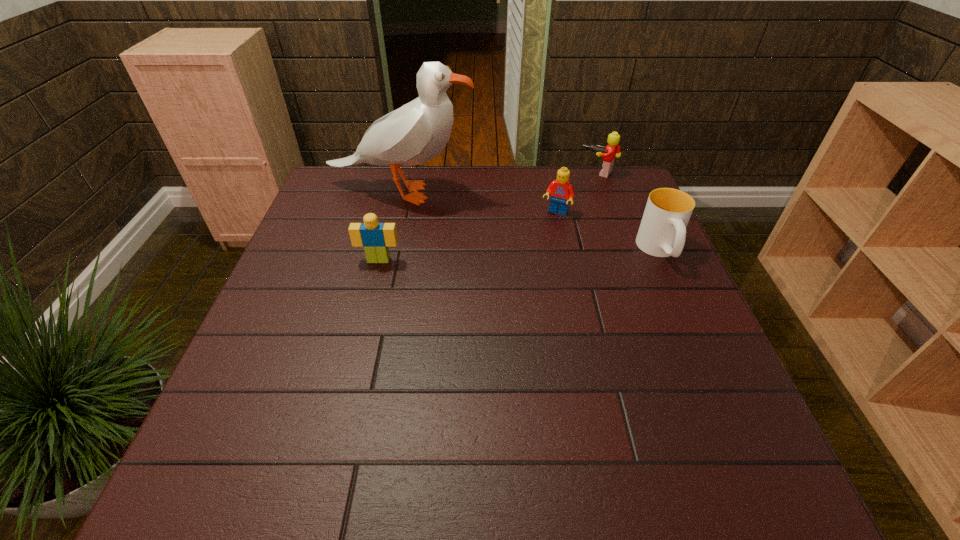
You are a GUI agent. You are given a task and a screenshot of the screen. Output one action in this format:
    pyautogui.click(x=<x>, y=<y>)
    Task: Click on the vacant spot on the desktop that is between the leftmost Lego and the cup and is positioned on the face of the third object from left to right
    
    Given the screenshot: What is the action you would take?
    pyautogui.click(x=533, y=255)

What are the coordinates of `free space on the desktop that is between the nearest Lego and the cup and is positioned in front of the farthest Lego with the accessory visible` in the screenshot? It's located at (537, 255).

You are a GUI agent. You are given a task and a screenshot of the screen. Output one action in this format:
    pyautogui.click(x=<x>, y=<y>)
    Task: Click on the free space on the desktop that is between the leftmost Lego and the cup and is positioned at the beak of the gull
    The width and height of the screenshot is (960, 540).
    Given the screenshot: What is the action you would take?
    pyautogui.click(x=531, y=255)